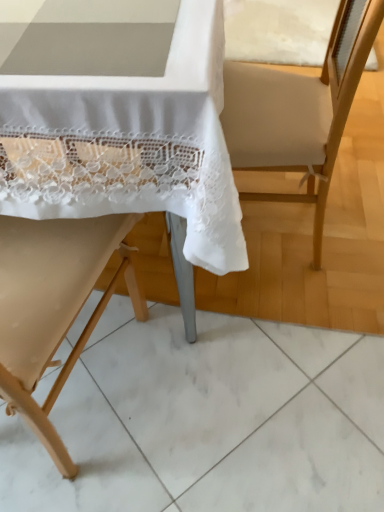
At what (x,y) coordinates should I click in order to perform the action: click on free point to the right of beige fabric armchair at center. Please return your answer as a coordinate pair (x, y). Looking at the image, I should click on (354, 212).